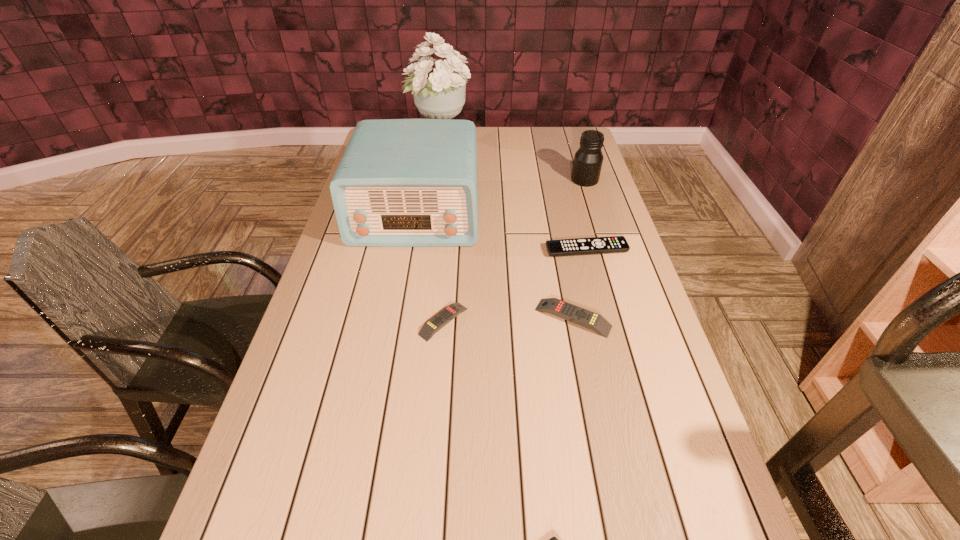
Identify the location of green bouquet. Image resolution: width=960 pixels, height=540 pixels. (440, 94).

Locate an element on the screen. This screenshot has height=540, width=960. the tallest object is located at coordinates (440, 94).

What are the coordinates of `the second tallest object` in the screenshot? It's located at (401, 182).

You are a GUI agent. You are given a task and a screenshot of the screen. Output one action in this format:
    pyautogui.click(x=<x>, y=<y>)
    Task: Click on the jar
    The width and height of the screenshot is (960, 540).
    Given the screenshot: What is the action you would take?
    pyautogui.click(x=588, y=159)

The width and height of the screenshot is (960, 540). Find the location of `the bigger yellow remote control`. the bigger yellow remote control is located at coordinates (583, 317).

Where is `the farther black remote control`? The height and width of the screenshot is (540, 960). the farther black remote control is located at coordinates (613, 244).

Locate an element on the screen. The image size is (960, 540). the farthest remote control is located at coordinates (613, 244).

The width and height of the screenshot is (960, 540). I want to click on the leftmost remote control, so click(450, 312).

I want to click on the smaller yellow remote control, so pos(450,312).

Find the location of `vacant space located 0.310m on the right of the bouquet`. vacant space located 0.310m on the right of the bouquet is located at coordinates (548, 143).